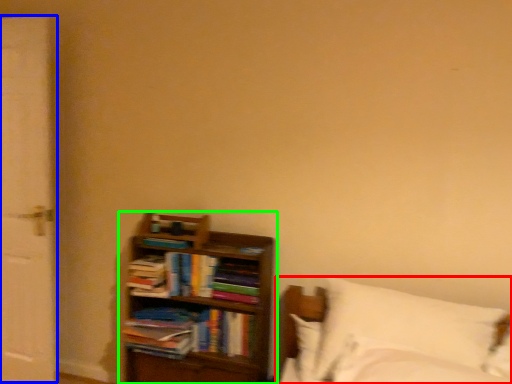
Question: Which is farther away from bed (highlighted by a red box)? screen door (highlighted by a blue box) or bookcase (highlighted by a green box)?

Choices:
 (A) screen door
 (B) bookcase

Answer: (A)